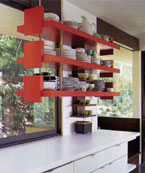
Identify the location of pitcher handle. (92, 23).